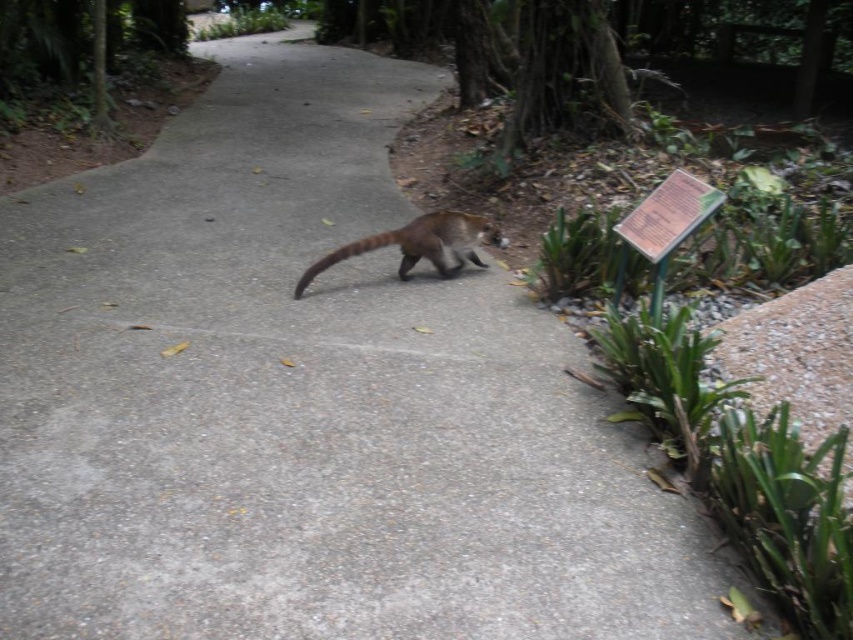
Question: Which object appears farthest from the camera in this image?

Choices:
 (A) brown fuzzy tail at center
 (B) green plastic sign at right

Answer: (A)

Question: From the image, what is the correct spatial relationship of green plastic sign at right in relation to brown fuzzy tail at center?

Choices:
 (A) left
 (B) right

Answer: (B)

Question: Is green plastic sign at right positioned at the back of brown fuzzy tail at center?

Choices:
 (A) yes
 (B) no

Answer: (B)

Question: Does green plastic sign at right appear on the left side of brown fuzzy tail at center?

Choices:
 (A) yes
 (B) no

Answer: (B)

Question: Among these objects, which one is nearest to the camera?

Choices:
 (A) green plastic sign at right
 (B) brown fuzzy tail at center

Answer: (A)